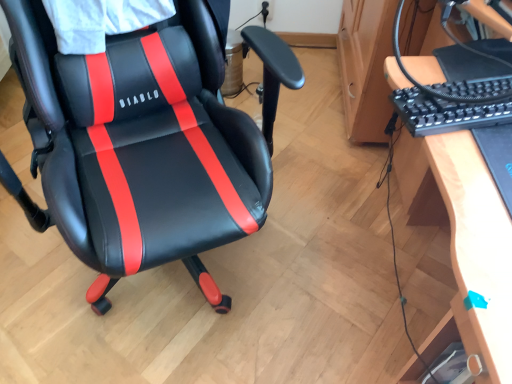
Describe the element at coordinates (465, 235) in the screenshot. Image resolution: width=512 pixels, height=384 pixels. I see `wooden desk at right` at that location.

What are the coordinates of `black plastic keyboard at right` in the screenshot? It's located at (453, 106).

From the image's perspective, does black plastic keyboard at right appear lower than wooden desk at right?

No, from the image's perspective, black plastic keyboard at right is not beneath wooden desk at right.

Is black plastic keyboard at right positioned beyond the bounds of wooden desk at right?

Indeed, black plastic keyboard at right is completely outside wooden desk at right.

Between black plastic keyboard at right and wooden desk at right, which one is positioned behind?

Positioned behind is black plastic keyboard at right.

Where is `computer keyboard that is above the black leather chair at center (from a real-world perspective)`? This screenshot has width=512, height=384. computer keyboard that is above the black leather chair at center (from a real-world perspective) is located at coordinates [x=453, y=106].

How many degrees apart are the facing directions of black leather chair at center and black plastic keyboard at right?

The facing directions of black leather chair at center and black plastic keyboard at right are 103 degrees apart.

From the image's perspective, is black leather chair at center positioned above or below black plastic keyboard at right?

Based on their image positions, black leather chair at center is located beneath black plastic keyboard at right.

Considering the positions of objects black leather chair at center and black plastic keyboard at right in the image provided, who is in front, black leather chair at center or black plastic keyboard at right?

black leather chair at center is closer to the camera.

Considering the relative sizes of wooden desk at right and black plastic keyboard at right in the image provided, is wooden desk at right thinner than black plastic keyboard at right?

Yes, wooden desk at right is thinner than black plastic keyboard at right.

Considering the relative positions of wooden desk at right and black plastic keyboard at right in the image provided, is wooden desk at right to the left or to the right of black plastic keyboard at right?

In the image, wooden desk at right appears on the left side of black plastic keyboard at right.

From a real-world perspective, between wooden desk at right and black plastic keyboard at right, who is vertically lower?

In real-world perspective, black plastic keyboard at right is lower.

From the image's perspective, is wooden desk at right located above black plastic keyboard at right?

Actually, wooden desk at right appears below black plastic keyboard at right in the image.

Is black leather chair at center oriented away from wooden desk at right?

No.

From the image's perspective, which object appears higher, black leather chair at center or wooden desk at right?

From the image's view, black leather chair at center is above.

Would you say black leather chair at center contains wooden desk at right?

No, black leather chair at center does not contain wooden desk at right.

Can you tell me how much black plastic keyboard at right and black leather chair at center differ in facing direction?

The angle between the facing direction of black plastic keyboard at right and the facing direction of black leather chair at center is 103 degrees.

From the image's perspective, who appears lower, black plastic keyboard at right or black leather chair at center?

From the image's view, black leather chair at center is below.

Is black plastic keyboard at right in contact with black leather chair at center?

black plastic keyboard at right is not next to black leather chair at center, and they're not touching.

Is point (430, 122) behind point (109, 140)?

No, (430, 122) is in front of (109, 140).

In the scene shown: Is wooden desk at right placed right next to black leather chair at center?

No, wooden desk at right is not in contact with black leather chair at center.

Identify the location of chair below the wooden desk at right (from a real-world perspective). (148, 142).

Do you think wooden desk at right is within black leather chair at center, or outside of it?

wooden desk at right is not enclosed by black leather chair at center.

Find the location of a particular element. The image size is (512, 384). computer keyboard behind the wooden desk at right is located at coordinates 453,106.

Where is `chair on the left of black plastic keyboard at right`? Image resolution: width=512 pixels, height=384 pixels. chair on the left of black plastic keyboard at right is located at coordinates (148, 142).

Which object lies further to the anchor point black plastic keyboard at right, wooden desk at right or black leather chair at center?

black leather chair at center.

Considering their positions, is wooden desk at right positioned further to black leather chair at center than black plastic keyboard at right?

wooden desk at right is positioned further to the anchor black leather chair at center.

Estimate the real-world distances between objects in this image. Which object is further from wooden desk at right, black leather chair at center or black plastic keyboard at right?

The object further to wooden desk at right is black leather chair at center.

Estimate the real-world distances between objects in this image. Which object is further from wooden desk at right, black plastic keyboard at right or black leather chair at center?

The object further to wooden desk at right is black leather chair at center.

Which object lies further to the anchor point black plastic keyboard at right, black leather chair at center or wooden desk at right?

black leather chair at center is further to black plastic keyboard at right.

Looking at the image, which one is located closer to black leather chair at center, black plastic keyboard at right or wooden desk at right?

black plastic keyboard at right.

Locate an element on the screen. desk between black leather chair at center and black plastic keyboard at right is located at coordinates (465, 235).